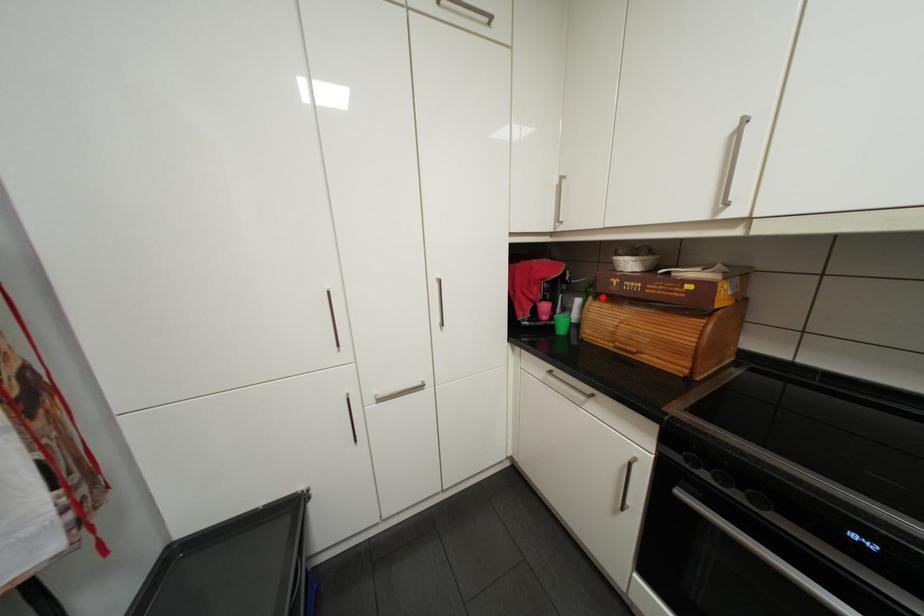
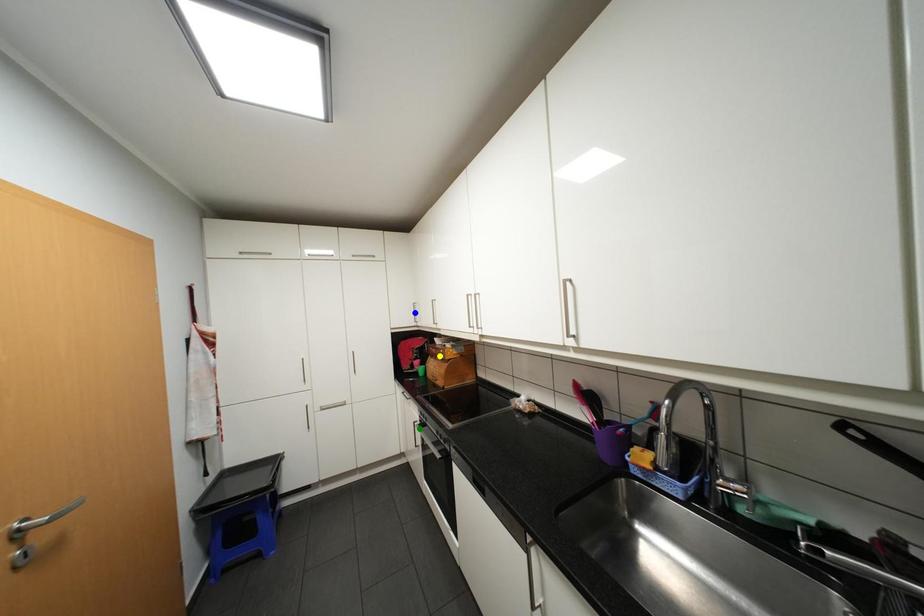
Question: I am providing you with two images of the same scene from different viewpoints. A red point is marked on the first image. You are given multiple points on the second image. Can you choose the point in image 2 that corresponds to the point in image 1?

Choices:
 (A) blue point
 (B) green point
 (C) yellow point

Answer: (C)